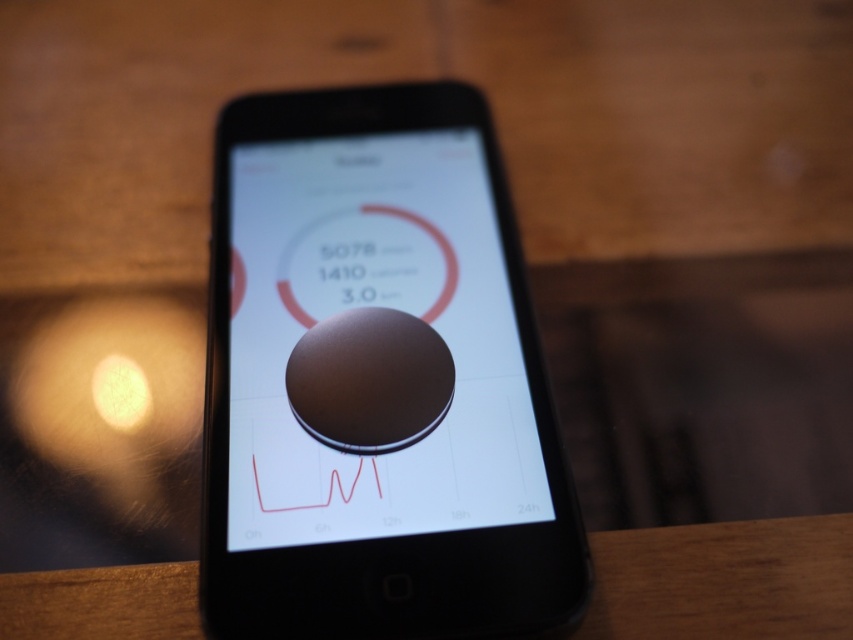
Question: Which object appears farthest from the camera in this image?

Choices:
 (A) matte brown circle at center
 (B) wooden table at center

Answer: (A)

Question: Is matte brown circle at center positioned at the back of wooden table at center?

Choices:
 (A) yes
 (B) no

Answer: (A)

Question: Can you confirm if matte brown circle at center is positioned above wooden table at center?

Choices:
 (A) no
 (B) yes

Answer: (B)

Question: Does matte brown circle at center lie behind wooden table at center?

Choices:
 (A) yes
 (B) no

Answer: (A)

Question: Which of the following is the closest to the observer?

Choices:
 (A) wooden table at center
 (B) matte brown circle at center

Answer: (A)